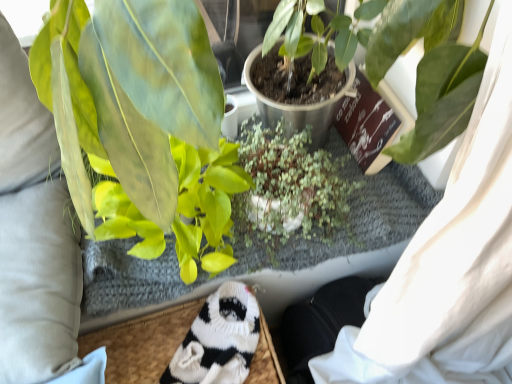
Image resolution: width=512 pixels, height=384 pixels. I want to click on blank space above white knitted socks at lower left (from a real-world perspective), so click(20, 271).